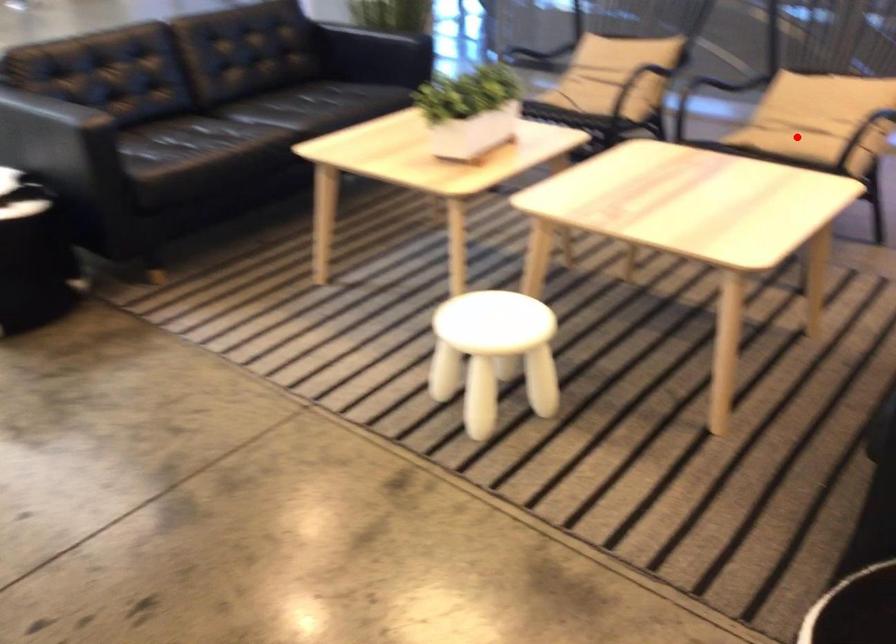
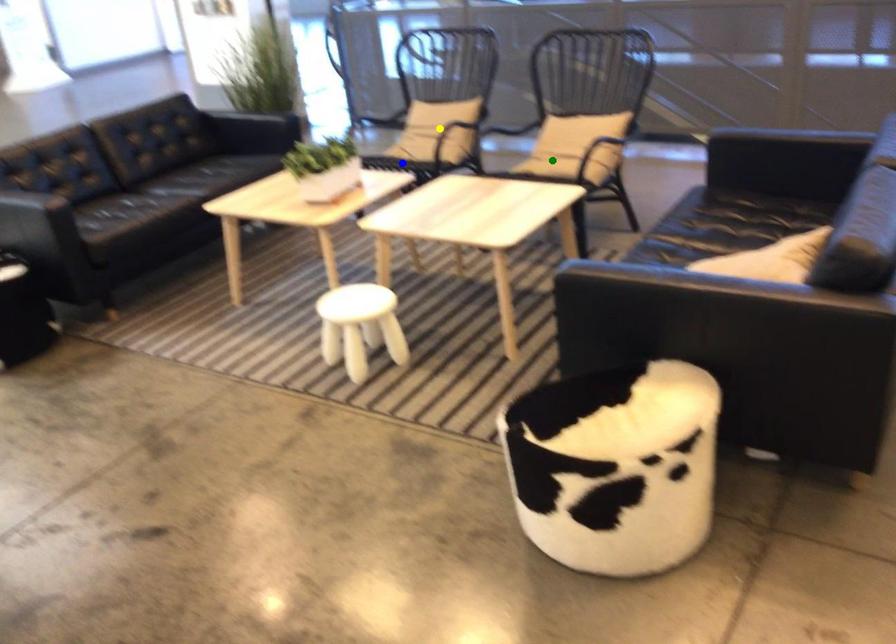
Question: I am providing you with two images of the same scene from different viewpoints. A red point is marked on the first image. You are given multiple points on the second image. In image 2, which mark is for the same physical point as the one in image 1?

Choices:
 (A) blue point
 (B) yellow point
 (C) green point

Answer: (C)